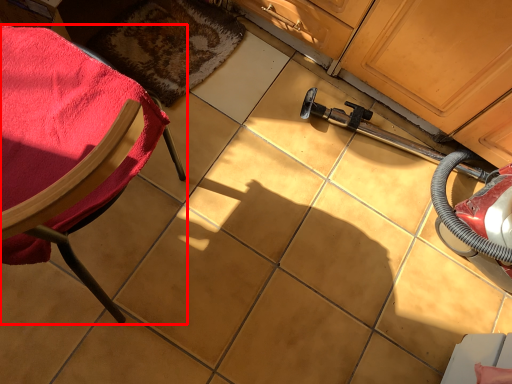
Question: Considering the relative positions of chair (annotated by the red box) and mat in the image provided, where is chair (annotated by the red box) located with respect to the staircase?

Choices:
 (A) left
 (B) right

Answer: (A)